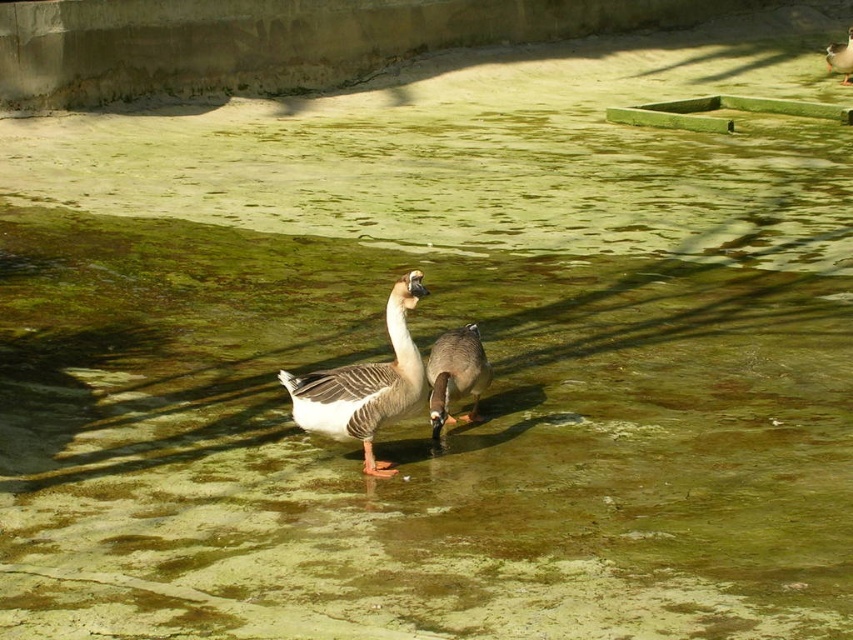
Question: Is white-gray feathered duck at center thinner than brown matte duck at upper right?

Choices:
 (A) yes
 (B) no

Answer: (B)

Question: Which point is farther from the camera taking this photo?

Choices:
 (A) (468, 419)
 (B) (843, 72)
 (C) (399, 349)

Answer: (B)

Question: Is brown speckled duck at center positioned at the back of brown matte duck at upper right?

Choices:
 (A) no
 (B) yes

Answer: (A)

Question: Which point is farther to the camera?

Choices:
 (A) (288, 388)
 (B) (849, 49)

Answer: (B)

Question: Among these points, which one is farthest from the camera?

Choices:
 (A) (460, 355)
 (B) (403, 337)
 (C) (830, 44)

Answer: (C)

Question: Can you confirm if white-gray feathered duck at center is smaller than brown speckled duck at center?

Choices:
 (A) yes
 (B) no

Answer: (B)